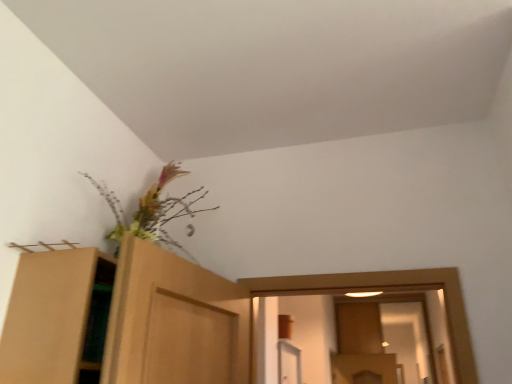
What do you see at coordinates (382, 341) in the screenshot?
I see `matte wooden mirror at center` at bounding box center [382, 341].

You are a GUI agent. You are given a task and a screenshot of the screen. Output one action in this format:
    pyautogui.click(x=<x>, y=<y>)
    Task: Click on the matte wooden mirror at center
    
    Given the screenshot: What is the action you would take?
    pyautogui.click(x=382, y=341)

The height and width of the screenshot is (384, 512). I want to click on matte wooden mirror at center, so click(382, 341).